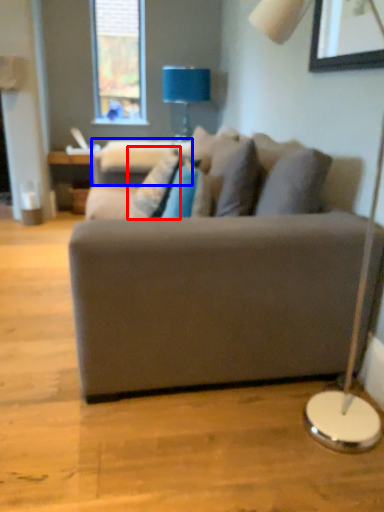
Question: Which point is further to the camera, pillow (highlighted by a red box) or swivel chair (highlighted by a blue box)?

Choices:
 (A) pillow
 (B) swivel chair

Answer: (B)